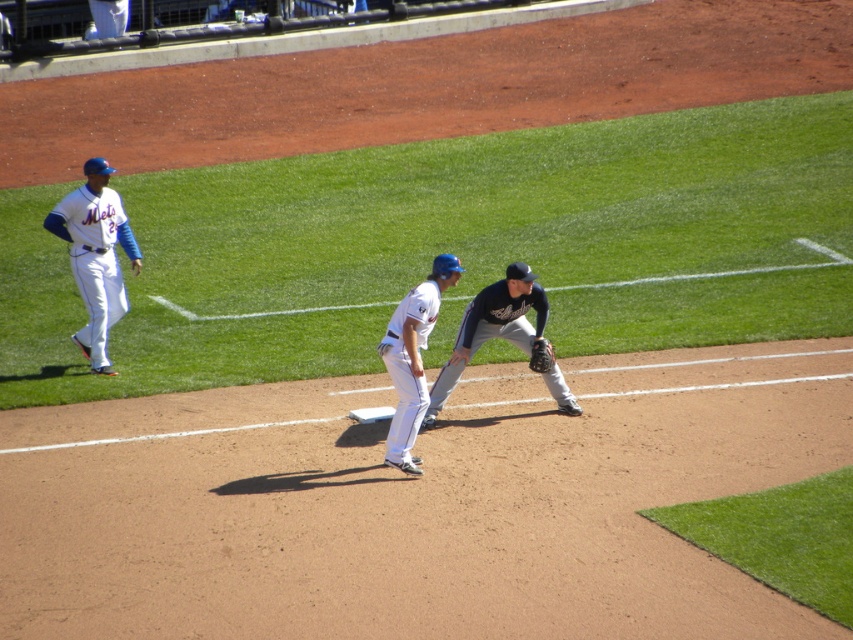
You are a photographer standing at the edge of the baseball field. You want to take a picture of the white uniform at center and the dark brown leather glove at lower center. Which object should you focus on first if you want to capture both in a single shot without moving the camera?

The white uniform at center is positioned on the left side of dark brown leather glove at lower center. Since the white uniform is closer to the left edge of the frame, you should focus on it first to ensure both objects are within the camera frame.

You are a photographer positioned at the edge of the field. You want to take a photo of the white uniform at center and the dark brown leather glove at lower center. Which object should you focus on first to ensure both are in sharp focus?

The white uniform at center is closer to the viewer than the dark brown leather glove at lower center. To ensure both are in sharp focus, you should focus on the white uniform at center first, as it is closer, and the depth of field will naturally extend to the darker brown leather glove at lower center.

You are a photographer positioned at the center of the field. You want to take a photo of the white uniformed player at left and the white uniform at center. Which player is closer to the left side of your camera frame?

The white uniformed player at left is closer to the left side of your camera frame because he is positioned to the left of the white uniform at center.